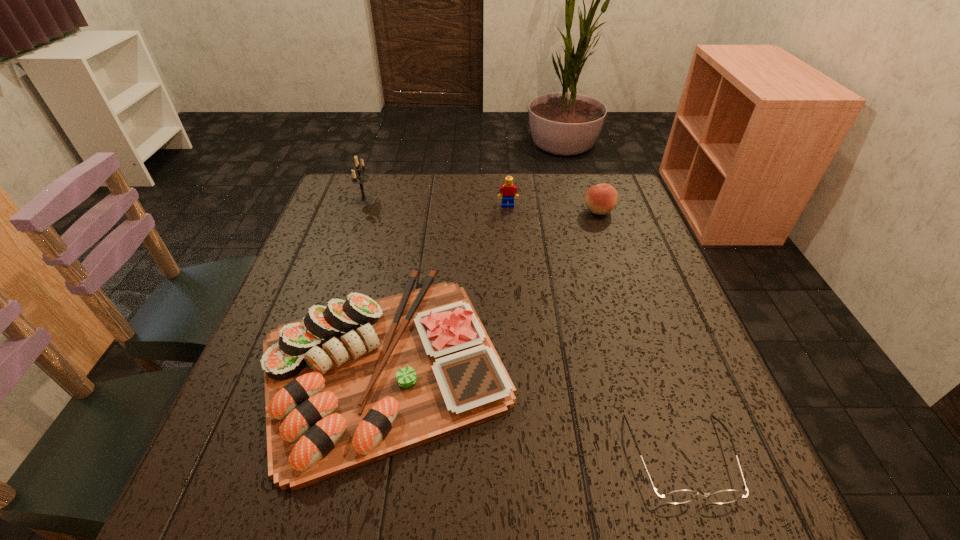
This screenshot has height=540, width=960. I want to click on object at the far right corner, so click(x=600, y=199).

Find the location of a particular element. Image resolution: width=960 pixels, height=540 pixels. object present at the near right corner is located at coordinates (679, 496).

Locate an element on the screen. free spot at the far edge of the desktop is located at coordinates (435, 197).

This screenshot has height=540, width=960. Find the location of `vacant space at the near edge of the desktop`. vacant space at the near edge of the desktop is located at coordinates (546, 510).

I want to click on vacant space at the left edge, so click(x=343, y=271).

In the image, there is a desktop. Identify the location of free region at the right edge. Image resolution: width=960 pixels, height=540 pixels. (692, 429).

I want to click on free space at the far left corner of the desktop, so click(x=347, y=206).

Image resolution: width=960 pixels, height=540 pixels. I want to click on vacant space at the near left corner, so click(241, 471).

At what (x,y) coordinates should I click in order to perform the action: click on free space at the far right corner of the desktop. Please return your answer as a coordinate pair (x, y). This screenshot has width=960, height=540. Looking at the image, I should click on (633, 213).

Find the location of a particular element. The width and height of the screenshot is (960, 540). vacant space at the near right corner is located at coordinates pyautogui.click(x=751, y=489).